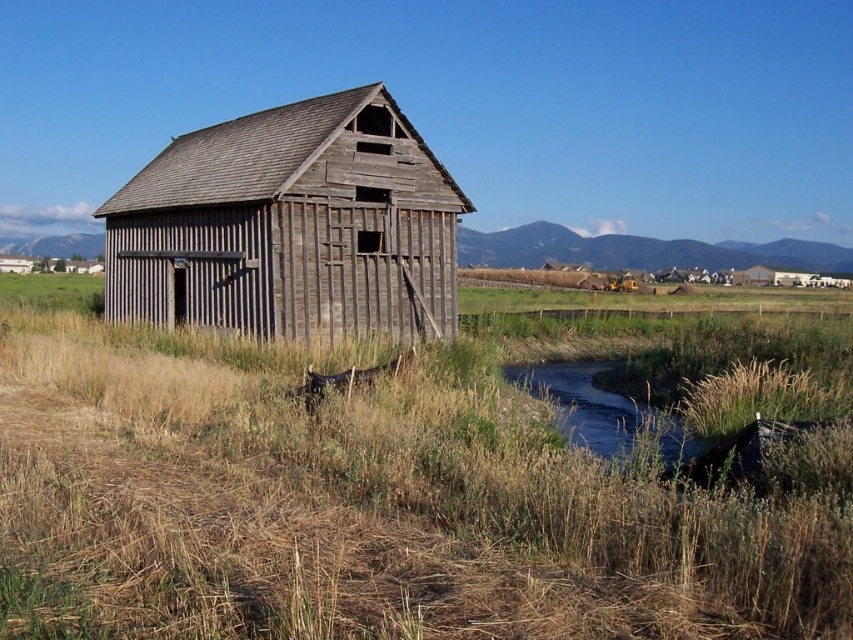
Can you confirm if dry grass at center is smaller than weathered wood barn at center?

Yes, dry grass at center is smaller than weathered wood barn at center.

Does dry grass at center appear on the left side of weathered wood barn at center?

In fact, dry grass at center is to the right of weathered wood barn at center.

Between point (498, 440) and point (311, 163), which one is positioned behind?

The point (311, 163) is behind.

Where is `dry grass at center`? dry grass at center is located at coordinates (360, 506).

Is weathered wood barn at center taller than green grassy creek at lower center?

Indeed, weathered wood barn at center has a greater height compared to green grassy creek at lower center.

Who is shorter, weathered wood barn at center or green grassy creek at lower center?

green grassy creek at lower center is shorter.

Between point (370, 248) and point (616, 440), which one is positioned in front?

Point (616, 440)

Locate an element on the screen. weathered wood barn at center is located at coordinates (289, 225).

Which is behind, point (741, 516) or point (581, 388)?

The point (581, 388) is more distant.

You are a GUI agent. You are given a task and a screenshot of the screen. Output one action in this format:
    pyautogui.click(x=<x>, y=<y>)
    Task: Click on the dry grass at center
    
    Given the screenshot: What is the action you would take?
    pyautogui.click(x=360, y=506)